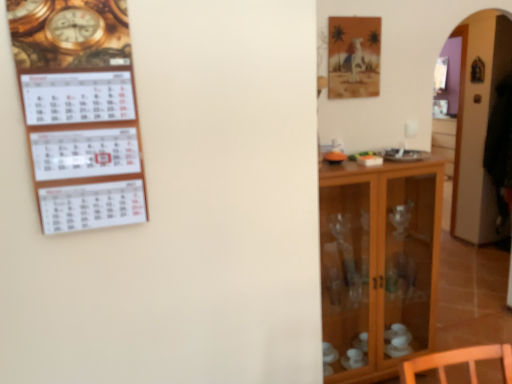
Question: Is transparent glass cabinet at right not close to white paper calendar at left?

Choices:
 (A) no
 (B) yes

Answer: (B)

Question: Can you confirm if transparent glass cabinet at right is smaller than white paper calendar at left?

Choices:
 (A) yes
 (B) no

Answer: (B)

Question: Is white paper calendar at left at the back of transparent glass cabinet at right?

Choices:
 (A) no
 (B) yes

Answer: (A)

Question: Is the depth of transparent glass cabinet at right less than that of white paper calendar at left?

Choices:
 (A) no
 (B) yes

Answer: (A)

Question: Does transparent glass cabinet at right have a lesser width compared to white paper calendar at left?

Choices:
 (A) no
 (B) yes

Answer: (A)

Question: From a real-world perspective, is matte brown picture frame at upper right above or below white paper calendar at left?

Choices:
 (A) below
 (B) above

Answer: (B)

Question: Is matte brown picture frame at upper right bigger or smaller than white paper calendar at left?

Choices:
 (A) small
 (B) big

Answer: (A)

Question: From the image's perspective, is matte brown picture frame at upper right located above or below white paper calendar at left?

Choices:
 (A) below
 (B) above

Answer: (B)

Question: From their relative heights in the image, would you say matte brown picture frame at upper right is taller or shorter than white paper calendar at left?

Choices:
 (A) short
 (B) tall

Answer: (A)

Question: Is white paper calendar at left to the left or to the right of matte brown picture frame at upper right in the image?

Choices:
 (A) right
 (B) left

Answer: (B)

Question: From a real-world perspective, is white paper calendar at left positioned above or below matte brown picture frame at upper right?

Choices:
 (A) below
 (B) above

Answer: (A)

Question: From the image's perspective, relative to matte brown picture frame at upper right, is white paper calendar at left above or below?

Choices:
 (A) above
 (B) below

Answer: (B)

Question: Does point (81, 134) appear closer or farther from the camera than point (347, 66)?

Choices:
 (A) farther
 (B) closer

Answer: (B)

Question: Looking at their shapes, would you say matte brown picture frame at upper right is wider or thinner than transparent glass cabinet at right?

Choices:
 (A) wide
 (B) thin

Answer: (B)

Question: Considering the positions of point (367, 64) and point (475, 29), is point (367, 64) closer or farther from the camera than point (475, 29)?

Choices:
 (A) farther
 (B) closer

Answer: (B)